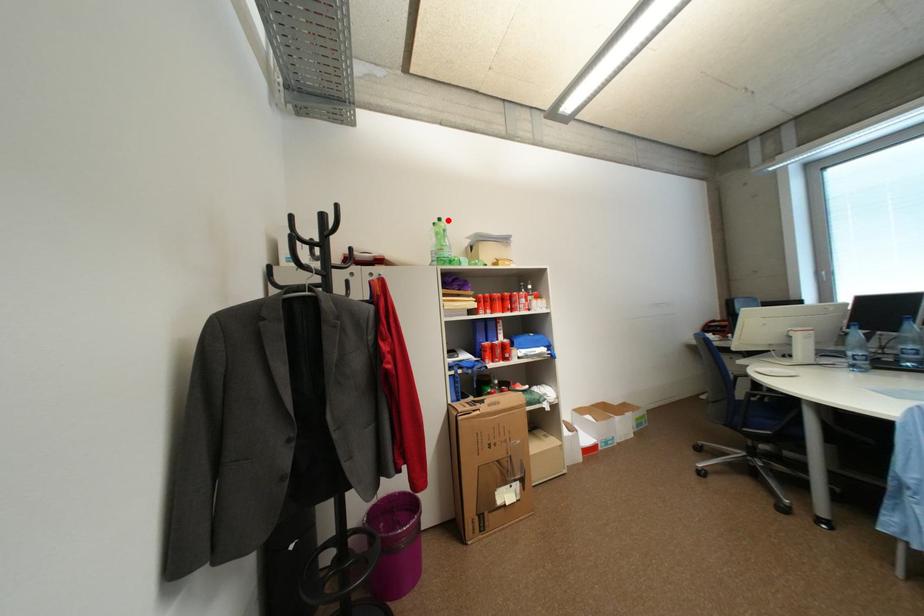
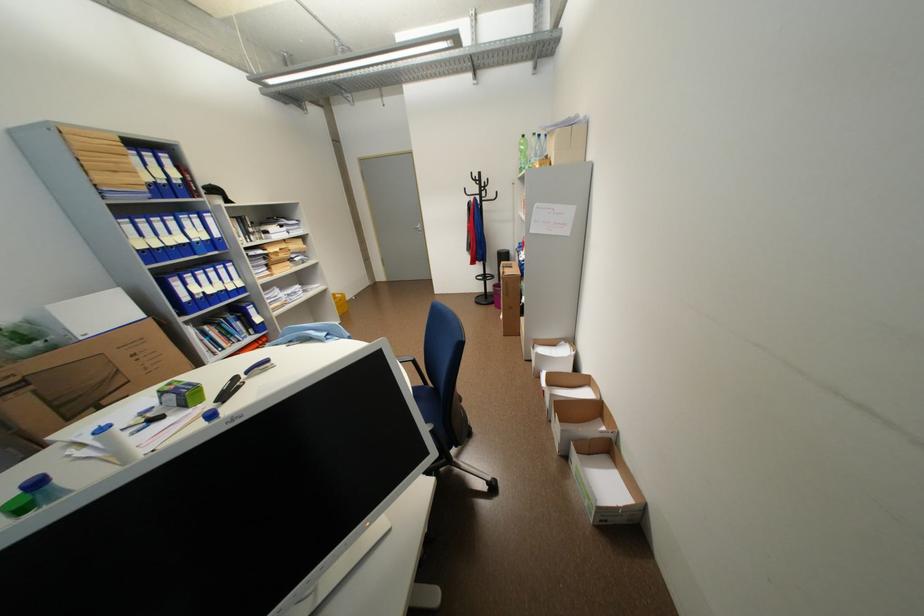
Where in the second image is the point corresponding to the highlighted location from the first image?

(531, 137)